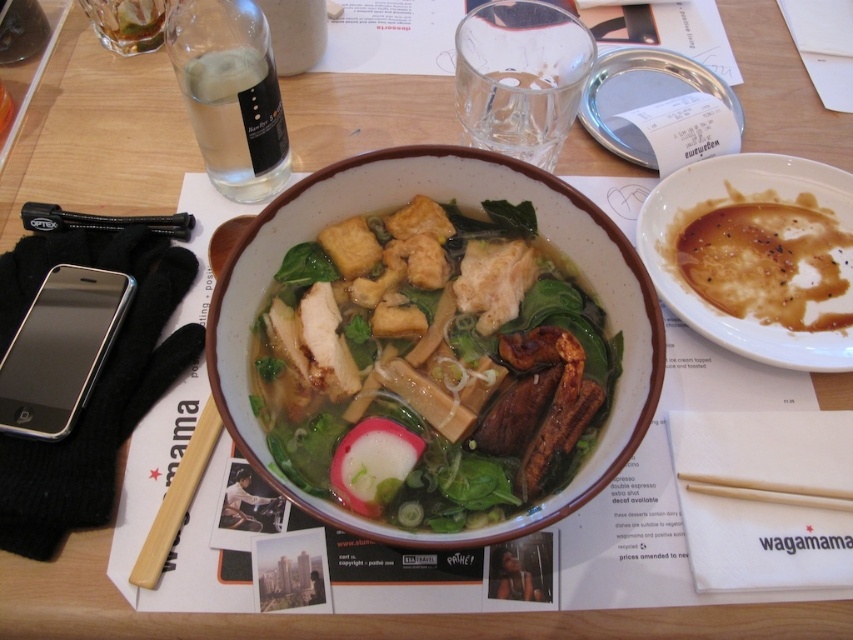
Who is more distant from viewer, (502, 490) or (801, 240)?

Point (801, 240)

Measure the distance between point (345,275) and camera.

Point (345,275) and camera are 15.88 inches apart.

Find the location of a particular element. The image size is (853, 640). translucent broth with mixed vegetables and tofu at center is located at coordinates click(x=431, y=365).

Who is more forward, (279, 275) or (9, 362)?

Point (279, 275) is more forward.

Is point (558, 292) positioned before point (126, 282)?

Yes, it is.

Where is `translucent broth with mixed vegetables and tofu at center`? The height and width of the screenshot is (640, 853). translucent broth with mixed vegetables and tofu at center is located at coordinates (431, 365).

Is point (338, 369) farther from viewer compared to point (184, 449)?

That is False.

Can you confirm if translucent broth with mixed vegetables and tofu at center is thinner than wooden chopstick at center?

Incorrect, translucent broth with mixed vegetables and tofu at center's width is not less than wooden chopstick at center's.

Is point (383, 451) positioned after point (216, 438)?

No, it is in front of (216, 438).

Identify the location of translucent broth with mixed vegetables and tofu at center. (431, 365).